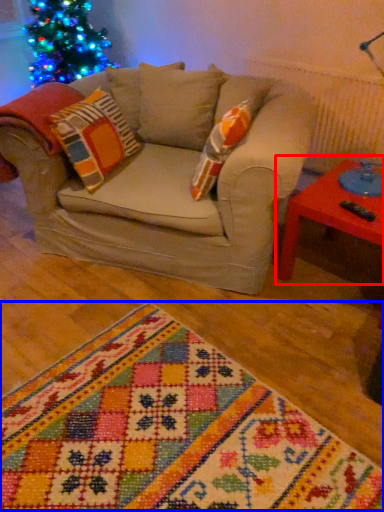
Question: Which object is closer to the camera taking this photo, table (highlighted by a red box) or blanket (highlighted by a blue box)?

Choices:
 (A) table
 (B) blanket

Answer: (B)